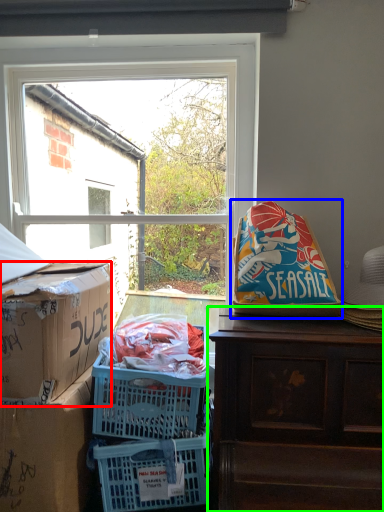
Question: Which is farther away from box (highlighted by a red box)? bean bag chair (highlighted by a blue box) or desk (highlighted by a green box)?

Choices:
 (A) bean bag chair
 (B) desk

Answer: (A)